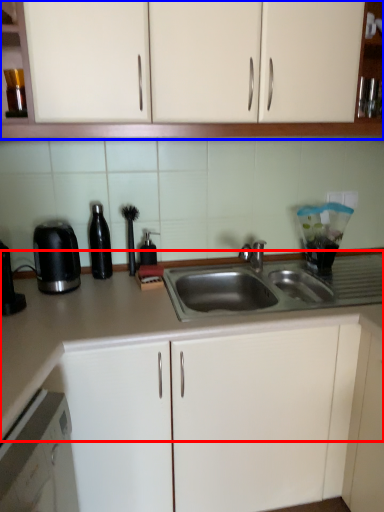
Question: Which of the following is the farthest to the observer, countertop (highlighted by a red box) or cabinetry (highlighted by a blue box)?

Choices:
 (A) countertop
 (B) cabinetry

Answer: (A)